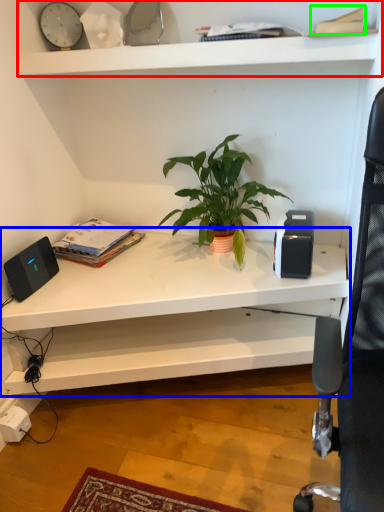
Question: Considering the real-world distances, which object is farthest from shelf (highlighted by a red box)? shelf (highlighted by a blue box) or paperback book (highlighted by a green box)?

Choices:
 (A) shelf
 (B) paperback book

Answer: (A)